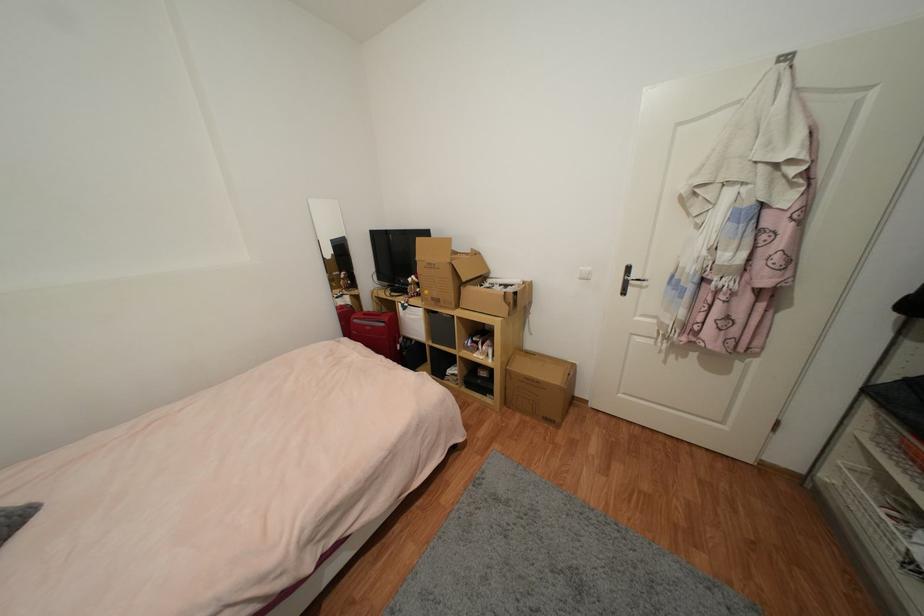
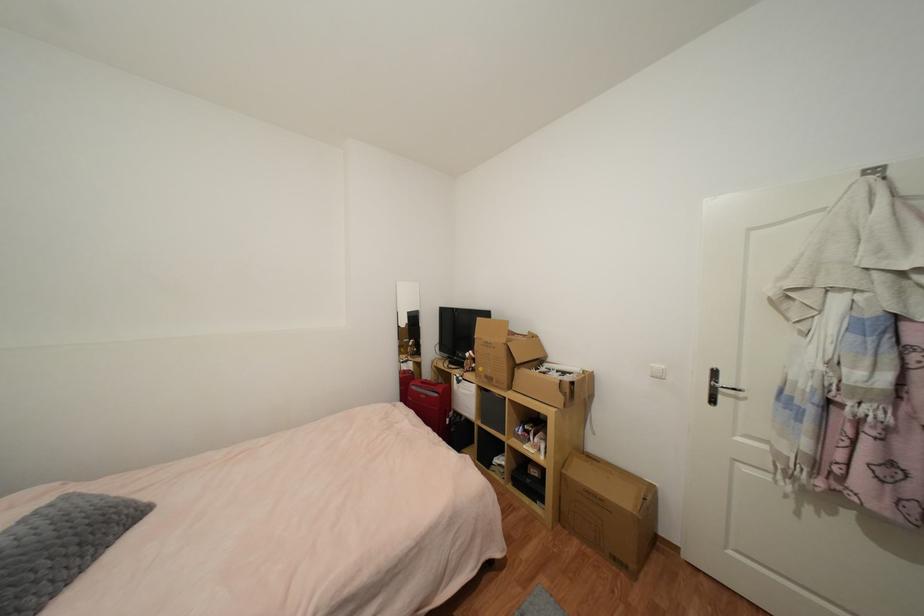
The point at (590, 280) is marked in the first image. Where is the corresponding point in the second image?

(663, 378)